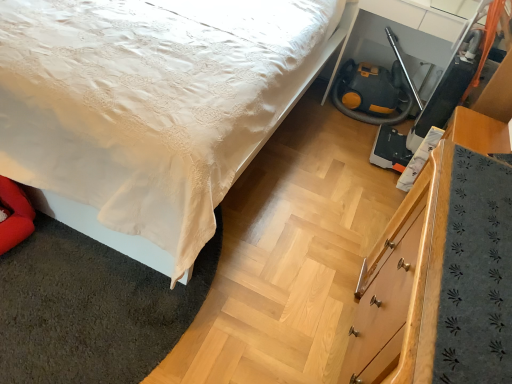
Where is `yellow rubber fire hose at lower right`? The height and width of the screenshot is (384, 512). yellow rubber fire hose at lower right is located at coordinates (374, 88).

From the picture: Considering the sizes of yellow rubber fire hose at lower right and white satin bed at center in the image, is yellow rubber fire hose at lower right wider or thinner than white satin bed at center?

In the image, yellow rubber fire hose at lower right appears to be more narrow than white satin bed at center.

Considering the relative sizes of yellow rubber fire hose at lower right and white satin bed at center in the image provided, is yellow rubber fire hose at lower right shorter than white satin bed at center?

Yes.

Is yellow rubber fire hose at lower right facing towards white satin bed at center?

No, yellow rubber fire hose at lower right does not turn towards white satin bed at center.

Is yellow rubber fire hose at lower right positioned beyond the bounds of white satin bed at center?

Yes, yellow rubber fire hose at lower right is located beyond the bounds of white satin bed at center.

Considering the sizes of objects white satin bed at center and wooden chest of drawers at lower right in the image provided, who is wider, white satin bed at center or wooden chest of drawers at lower right?

white satin bed at center is wider.

Is white satin bed at center shorter than wooden chest of drawers at lower right?

No, white satin bed at center is not shorter than wooden chest of drawers at lower right.

From a real-world perspective, is white satin bed at center above or below wooden chest of drawers at lower right?

white satin bed at center is situated higher than wooden chest of drawers at lower right in the real world.

From the image's perspective, is white satin bed at center beneath wooden chest of drawers at lower right?

Actually, white satin bed at center appears above wooden chest of drawers at lower right in the image.

Is point (498, 127) farther from viewer compared to point (199, 137)?

Yes, point (498, 127) is farther from viewer.

Between wooden chest of drawers at lower right and white satin bed at center, which one has larger width?

With larger width is white satin bed at center.

Between wooden chest of drawers at lower right and white satin bed at center, which one appears on the right side from the viewer's perspective?

wooden chest of drawers at lower right is more to the right.

Can you tell me how much wooden chest of drawers at lower right and white satin bed at center differ in facing direction?

wooden chest of drawers at lower right and white satin bed at center are facing 91.2 degrees away from each other.

Where is `bed above the white satin bedspread at lower left (from a real-world perspective)`? bed above the white satin bedspread at lower left (from a real-world perspective) is located at coordinates (150, 102).

What's the angular difference between white satin bed at center and white satin bedspread at lower left's facing directions?

There is a 88.8-degree angle between the facing directions of white satin bed at center and white satin bedspread at lower left.

Is white satin bed at center placed right next to white satin bedspread at lower left?

No, white satin bed at center is not beside white satin bedspread at lower left.

Is white satin bed at center wider or thinner than white satin bedspread at lower left?

In the image, white satin bed at center appears to be wider than white satin bedspread at lower left.

Based on the photo, considering the sizes of objects white satin bed at center and yellow rubber fire hose at lower right in the image provided, who is wider, white satin bed at center or yellow rubber fire hose at lower right?

A: Wider between the two is white satin bed at center.

Is white satin bed at center inside or outside of yellow rubber fire hose at lower right?

white satin bed at center is spatially situated outside yellow rubber fire hose at lower right.

The image size is (512, 384). In order to click on bed above the yellow rubber fire hose at lower right (from the image's perspective) in this screenshot , I will do `click(150, 102)`.

From the image's perspective, is white satin bed at center on top of yellow rubber fire hose at lower right?

Correct, white satin bed at center appears higher than yellow rubber fire hose at lower right in the image.

Considering the relative sizes of yellow rubber fire hose at lower right and white satin bedspread at lower left in the image provided, is yellow rubber fire hose at lower right thinner than white satin bedspread at lower left?

Correct, the width of yellow rubber fire hose at lower right is less than that of white satin bedspread at lower left.

Between yellow rubber fire hose at lower right and white satin bedspread at lower left, which one appears on the right side from the viewer's perspective?

Positioned to the right is yellow rubber fire hose at lower right.

From the picture: From a real-world perspective, is yellow rubber fire hose at lower right above or below white satin bedspread at lower left?

yellow rubber fire hose at lower right is above white satin bedspread at lower left.

Considering the sizes of yellow rubber fire hose at lower right and white satin bedspread at lower left in the image, is yellow rubber fire hose at lower right bigger or smaller than white satin bedspread at lower left?

Clearly, yellow rubber fire hose at lower right is larger in size than white satin bedspread at lower left.

How far apart are wooden chest of drawers at lower right and yellow rubber fire hose at lower right?

wooden chest of drawers at lower right is 5.17 feet from yellow rubber fire hose at lower right.

Can you confirm if wooden chest of drawers at lower right is smaller than yellow rubber fire hose at lower right?

Actually, wooden chest of drawers at lower right might be larger than yellow rubber fire hose at lower right.

Would you say yellow rubber fire hose at lower right is part of wooden chest of drawers at lower right's contents?

No, yellow rubber fire hose at lower right is not inside wooden chest of drawers at lower right.

Locate an element on the screen. Image resolution: width=512 pixels, height=384 pixels. fire hose below the white satin bed at center (from the image's perspective) is located at coordinates (374, 88).

Locate an element on the screen. This screenshot has height=384, width=512. chest of drawers located on the right of white satin bed at center is located at coordinates (412, 266).

Considering their positions, is white satin bed at center positioned closer to wooden chest of drawers at lower right than white satin bedspread at lower left?

white satin bedspread at lower left.

In the scene shown: Looking at the image, which one is located closer to yellow rubber fire hose at lower right, wooden chest of drawers at lower right or white satin bedspread at lower left?

wooden chest of drawers at lower right lies closer to yellow rubber fire hose at lower right than the other object.

Estimate the real-world distances between objects in this image. Which object is closer to wooden chest of drawers at lower right, yellow rubber fire hose at lower right or white satin bed at center?

white satin bed at center.

Considering their positions, is wooden chest of drawers at lower right positioned closer to white satin bed at center than yellow rubber fire hose at lower right?

Among the two, wooden chest of drawers at lower right is located nearer to white satin bed at center.

Looking at the image, which one is located further to yellow rubber fire hose at lower right, white satin bed at center or white satin bedspread at lower left?

white satin bedspread at lower left.

Estimate the real-world distances between objects in this image. Which object is further from yellow rubber fire hose at lower right, white satin bed at center or wooden chest of drawers at lower right?

wooden chest of drawers at lower right is positioned further to the anchor yellow rubber fire hose at lower right.

Based on their spatial positions, is white satin bed at center or yellow rubber fire hose at lower right closer to white satin bedspread at lower left?

white satin bed at center.

Considering their positions, is white satin bedspread at lower left positioned closer to wooden chest of drawers at lower right than white satin bed at center?

The object closer to wooden chest of drawers at lower right is white satin bedspread at lower left.

Where is `bed located between wooden chest of drawers at lower right and yellow rubber fire hose at lower right in the depth direction`? bed located between wooden chest of drawers at lower right and yellow rubber fire hose at lower right in the depth direction is located at coordinates (150, 102).

Where is `mat located between wooden chest of drawers at lower right and yellow rubber fire hose at lower right in the depth direction`? Image resolution: width=512 pixels, height=384 pixels. mat located between wooden chest of drawers at lower right and yellow rubber fire hose at lower right in the depth direction is located at coordinates (91, 308).

The height and width of the screenshot is (384, 512). I want to click on mat that lies between white satin bed at center and wooden chest of drawers at lower right from top to bottom, so click(91, 308).

Locate an element on the screen. This screenshot has width=512, height=384. mat between white satin bed at center and yellow rubber fire hose at lower right in the horizontal direction is located at coordinates (91, 308).